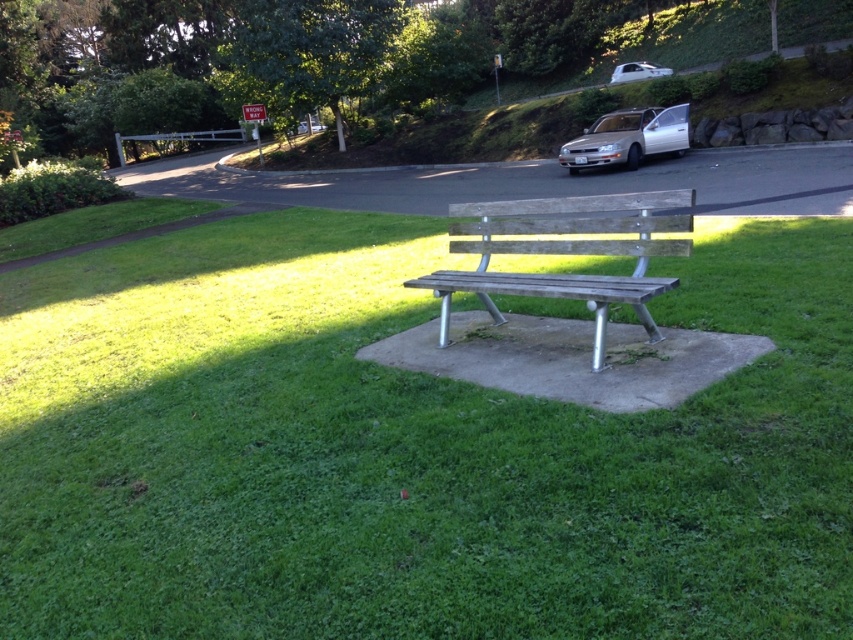
You are a gardener who needs to mow the lawn. The lawn mower you have can only cut grass that is shorter than the height of the weathered wood bench at center. Based on the scene, will the green grassy at center need to be trimmed before mowing?

The green grassy at center is taller than the weathered wood bench at center. Since the lawn mower can only cut grass shorter than the bench, the grass needs to be trimmed first to reduce its height below the bench height before mowing can be done.

You are a photographer planning to take a picture of the weathered wood bench at center and the silver metallic sedan at upper right. To ensure both are in focus, you need to know their relative positions. Which object is positioned higher in the image?

The silver metallic sedan at upper right is positioned higher in the image than the weathered wood bench at center.